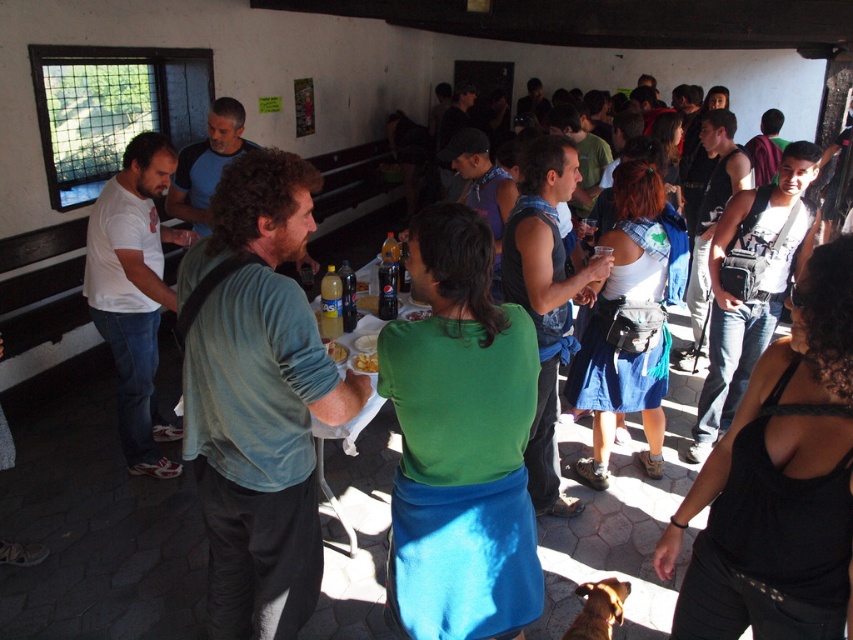
You are a photographer trying to capture a closeup of the yellow matte snack at center. You notice the white cotton shirt at left is partially blocking your view. Can you estimate if the shirt is large enough to fully cover the snack when positioned in front of it?

The white cotton shirt at left is bigger than the yellow matte snack at center, so it can fully cover the snack if positioned in front.

You are a photographer positioned at the entrance of the room. You want to take a photo of the yellow matte snack at center without the white cotton shirt at left blocking the view. Is this possible?

The white cotton shirt at left is further to the viewer than yellow matte snack at center, so it is blocking the view. Therefore, you cannot take a photo of the yellow matte snack at center without the white cotton shirt at left blocking the view.

You are a guest at this event and want to grab a snack from the table. The yellow matte snack at center is your target. However, there is a yellow matte plate at center nearby. How far apart are these two items?

The yellow matte snack at center and yellow matte plate at center are 3.10 inches apart.